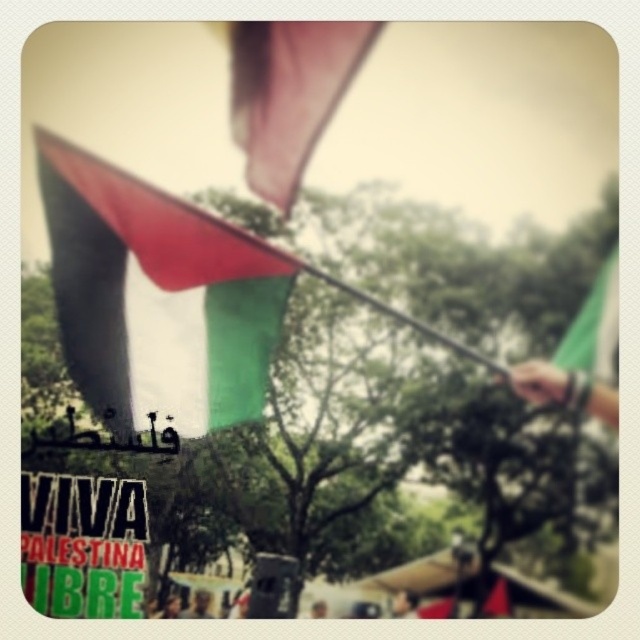
From the picture: You are a photographer adjusting your camera settings to capture the flag in the image. You notice the silky pink fabric at upper center and the green fabric flag at upper right. Which object should you focus on first if you want to ensure both are in sharp focus, considering their heights?

The silky pink fabric at upper center has a greater height compared to the green fabric flag at upper right, so you should focus on the silky pink fabric at upper center first to ensure both are in sharp focus.

You are a photographer analyzing the composition of this image. The point at coordinates point (x=156, y=298) is part of which object in the scene?

The point at coordinates point (x=156, y=298) corresponds to tri_color fabric flag at center.